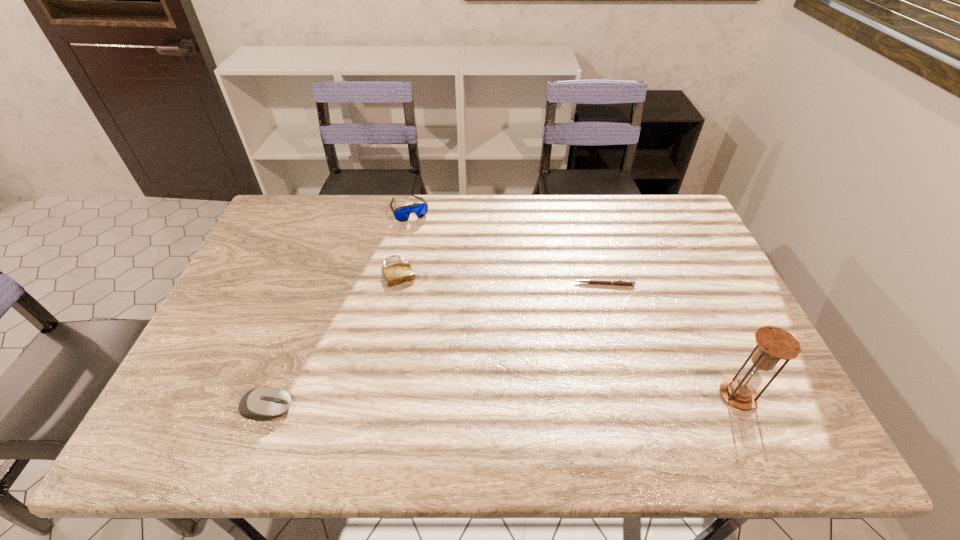
Locate an element on the screen. Image resolution: width=960 pixels, height=540 pixels. the third shortest object is located at coordinates (265, 402).

Identify the location of computer equipment. point(265,402).

Where is `the tallest object`? The width and height of the screenshot is (960, 540). the tallest object is located at coordinates (773, 343).

At what (x,y) coordinates should I click in order to perform the action: click on the rightmost object. Please return your answer as a coordinate pair (x, y). This screenshot has height=540, width=960. Looking at the image, I should click on (773, 343).

You are a GUI agent. You are given a task and a screenshot of the screen. Output one action in this format:
    pyautogui.click(x=<x>, y=<y>)
    Task: Click on the second shortest object
    The image size is (960, 540).
    Given the screenshot: What is the action you would take?
    pyautogui.click(x=398, y=273)

Locate an element on the screen. sunglasses is located at coordinates (402, 213).

This screenshot has width=960, height=540. In order to click on the fourth shortest object in this screenshot , I will do `click(402, 213)`.

Where is `the shortest object`? the shortest object is located at coordinates (591, 281).

Where is `the fourth object from left to right`? The width and height of the screenshot is (960, 540). the fourth object from left to right is located at coordinates (591, 281).

Locate an element on the screen. free spot located 0.350m on the wheel side of the computer equipment is located at coordinates (444, 408).